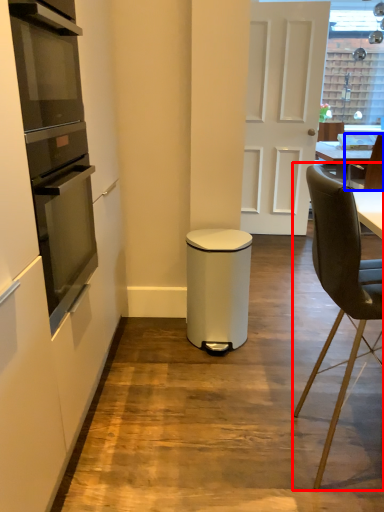
Question: Which object appears farthest to the camera in this image, chair (highlighted by a red box) or chair (highlighted by a blue box)?

Choices:
 (A) chair
 (B) chair

Answer: (B)